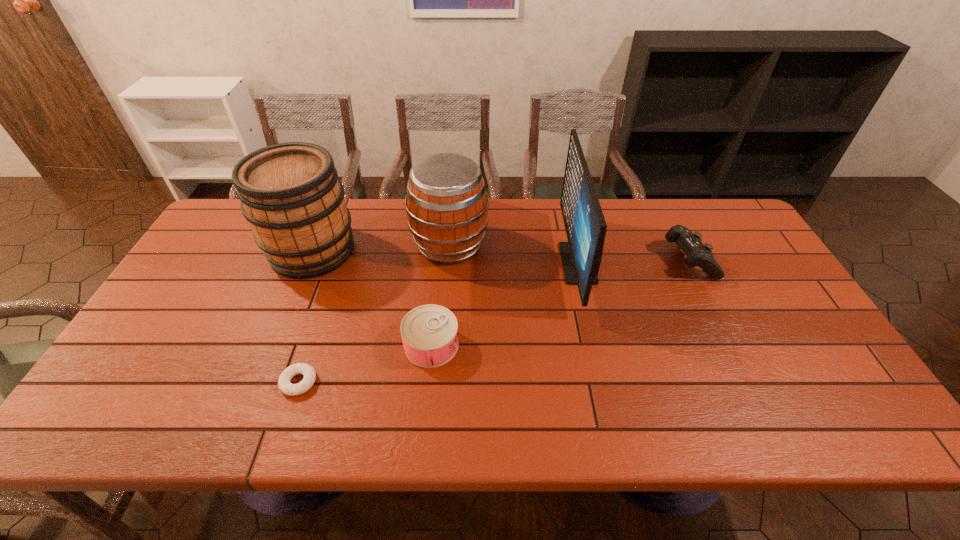
Locate an element on the screen. Image resolution: width=960 pixels, height=540 pixels. computer monitor is located at coordinates (585, 225).

Identify the location of the left cider. This screenshot has height=540, width=960. (290, 193).

Identify the location of the right cider. (447, 204).

Find the location of a particular element. control is located at coordinates (698, 254).

Identify the location of can. (429, 332).

The height and width of the screenshot is (540, 960). Identify the location of the shortest object. (284, 384).

Image resolution: width=960 pixels, height=540 pixels. Identify the location of free spot located 0.220m on the screen side of the fifth object from left to right. (488, 263).

The image size is (960, 540). In order to click on vacant area situated on the screen side of the fifth object from left to right in this screenshot , I will do `click(532, 263)`.

At what (x,y) coordinates should I click in order to perform the action: click on vacant area located on the screen side of the fifth object from left to right. Please return your answer as a coordinate pair (x, y). Looking at the image, I should click on (461, 263).

This screenshot has height=540, width=960. What are the coordinates of `vacant area located 0.340m on the front of the left cider` in the screenshot? It's located at (257, 388).